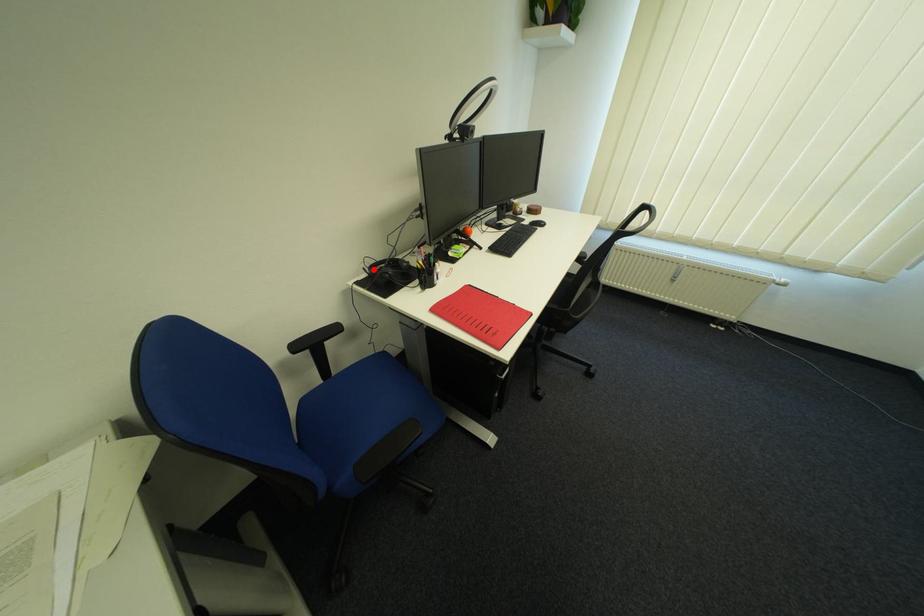
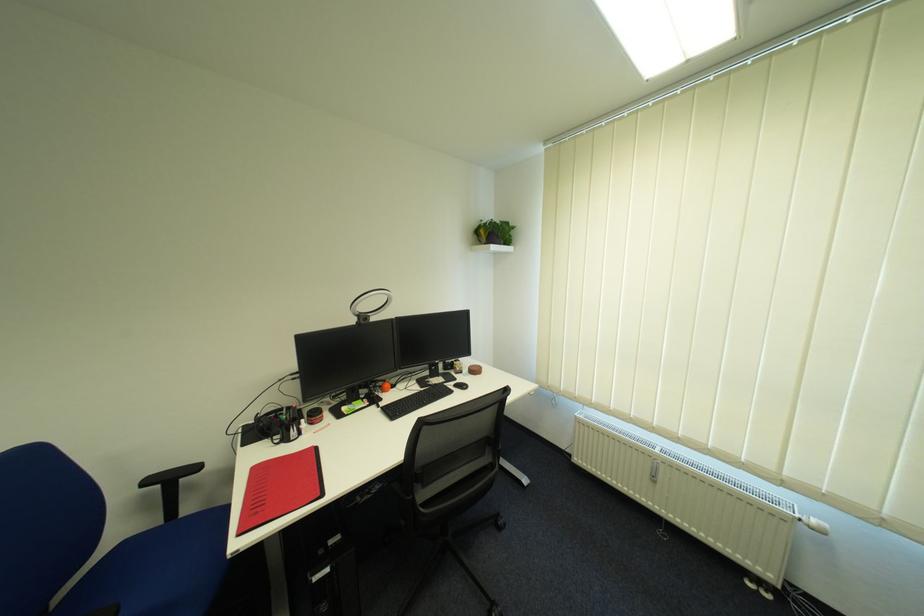
Find the pixel in the second image that matches the highlighted location in the first image.

(268, 415)